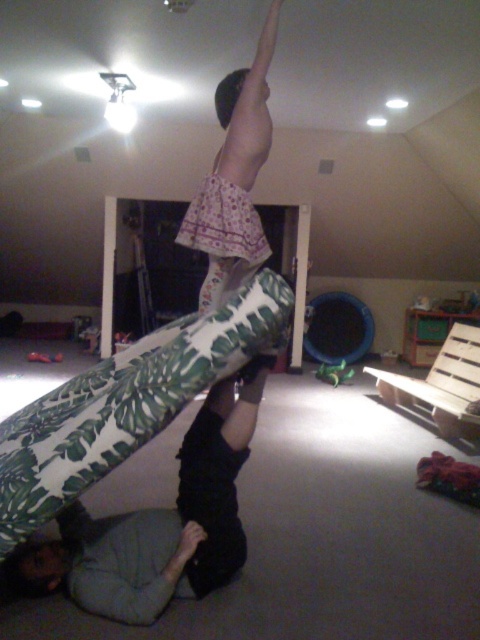
Is point (217, 256) closer to camera compared to point (458, 352)?

Yes, it is in front of point (458, 352).

Does pink floral skirt at upper center lie behind wooden pallet at lower right?

No, it is not.

This screenshot has width=480, height=640. Identify the location of pink floral skirt at upper center. (235, 177).

Locate an element on the screen. This screenshot has width=480, height=640. pink floral skirt at upper center is located at coordinates (235, 177).